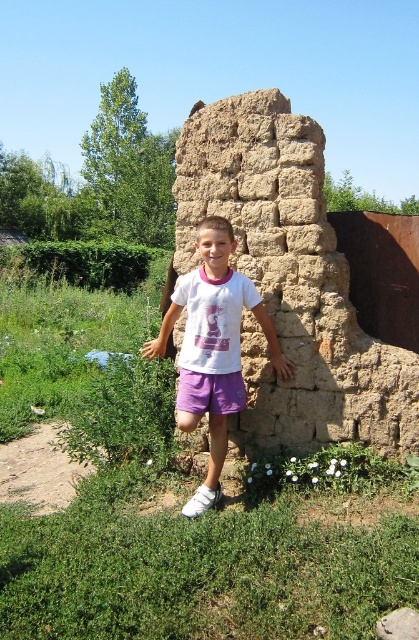
Is the position of white cotton shirt at center less distant than that of purple cotton shorts at center?

That is True.

Is point (206, 355) positioned before point (242, 381)?

Yes.

Measure the distance between point [188,429] and camera.

The distance of point [188,429] from camera is 3.59 meters.

Identify the location of white cotton shirt at center. (212, 348).

Who is positioned more to the left, green grass at center or brown mudbrick wall at center?

green grass at center

Measure the distance between green grass at center and brown mudbrick wall at center.

The distance of green grass at center from brown mudbrick wall at center is 1.61 meters.

The width and height of the screenshot is (419, 640). Describe the element at coordinates (173, 509) in the screenshot. I see `green grass at center` at that location.

Locate an element on the screen. green grass at center is located at coordinates (173, 509).

Who is positioned more to the right, brown mudbrick wall at center or white cotton shirt at center?

From the viewer's perspective, brown mudbrick wall at center appears more on the right side.

Is brown mudbrick wall at center to the left of white cotton shirt at center from the viewer's perspective?

In fact, brown mudbrick wall at center is to the right of white cotton shirt at center.

The width and height of the screenshot is (419, 640). I want to click on brown mudbrick wall at center, so click(x=291, y=282).